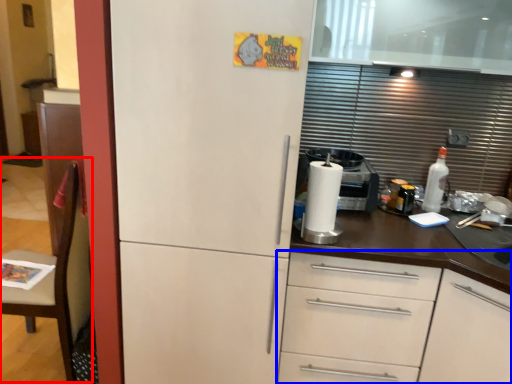
Question: Which point is closer to the camera, chair (highlighted by a red box) or cabinetry (highlighted by a blue box)?

Choices:
 (A) chair
 (B) cabinetry

Answer: (B)